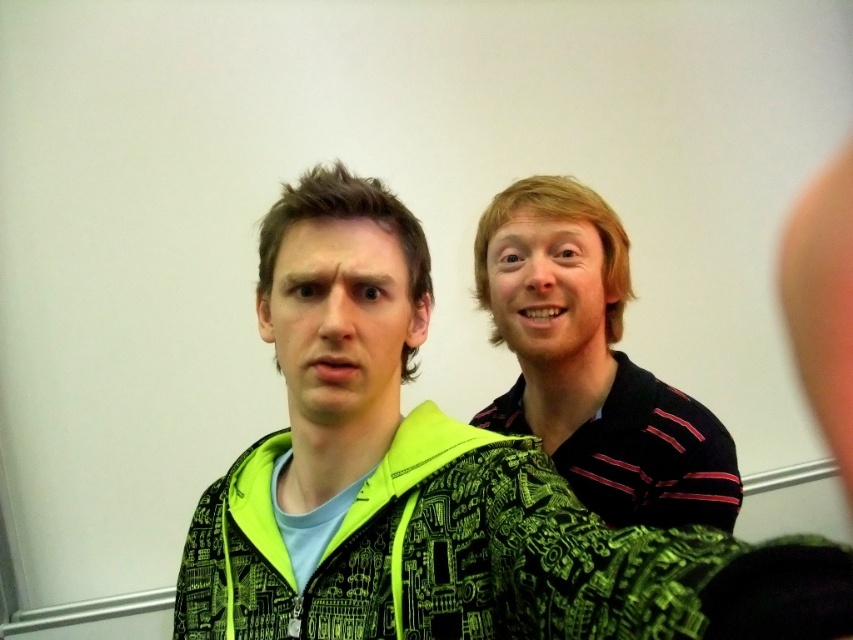
You are an architect designing a new building and need to place two important markers at specific coordinates. You have two points to consider in the image provided. Which of the two points, point (374, 333) or point (556, 227), is closer to you as the viewer?

Point (374, 333) is closer to the viewer than point (556, 227).

You are standing in the middle of the room and see the matte green jacket at center. If you want to move towards it, which direction should you walk?

Since the matte green jacket at center is located at point (x=340, y=317), you should walk directly towards it as it is already positioned at the center of the room.

You are a photographer setting up for a portrait. You want to ensure that both the striped cotton shirt at right and the smooth blonde hair at upper right are clearly visible in the frame. Based on their positions, which object should you focus on first to ensure both are in focus?

The striped cotton shirt at right is in front of the smooth blonde hair at upper right, so you should focus on the striped cotton shirt at right first. This way, since it is closer to the camera, adjusting the focus to it will help ensure the background object, the smooth blonde hair at upper right, remains in focus as well.